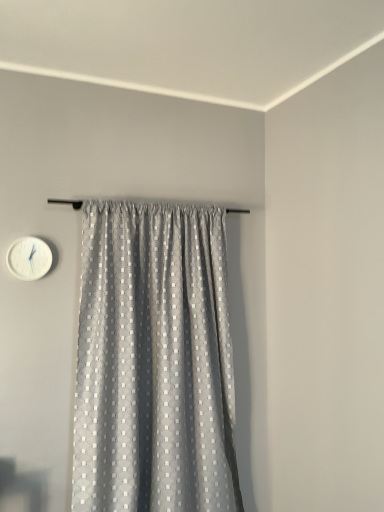
Question: From their relative heights in the image, would you say white plastic wall clock at upper left is taller or shorter than gray textured curtain at center?

Choices:
 (A) tall
 (B) short

Answer: (B)

Question: Considering the positions of point (26, 263) and point (112, 236), is point (26, 263) closer or farther from the camera than point (112, 236)?

Choices:
 (A) farther
 (B) closer

Answer: (B)

Question: Considering their positions, is white plastic wall clock at upper left located in front of or behind gray textured curtain at center?

Choices:
 (A) front
 (B) behind

Answer: (B)

Question: In terms of width, does gray textured curtain at center look wider or thinner when compared to white plastic wall clock at upper left?

Choices:
 (A) wide
 (B) thin

Answer: (A)

Question: Considering their positions, is gray textured curtain at center located in front of or behind white plastic wall clock at upper left?

Choices:
 (A) behind
 (B) front

Answer: (B)

Question: From their relative heights in the image, would you say gray textured curtain at center is taller or shorter than white plastic wall clock at upper left?

Choices:
 (A) short
 (B) tall

Answer: (B)

Question: Considering the positions of gray textured curtain at center and white plastic wall clock at upper left in the image, is gray textured curtain at center bigger or smaller than white plastic wall clock at upper left?

Choices:
 (A) small
 (B) big

Answer: (B)